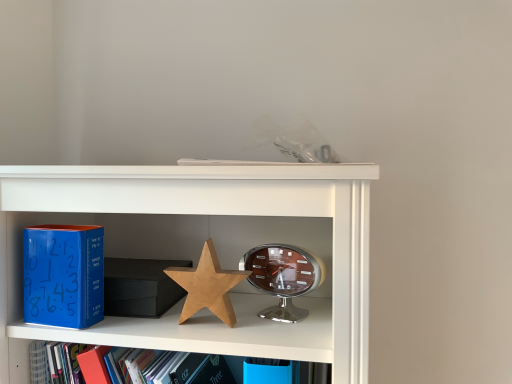
Question: In the image, is wooden star at center positioned in front of or behind blue matte clock at left?

Choices:
 (A) front
 (B) behind

Answer: (B)

Question: From a real-world perspective, is wooden star at center positioned above or below blue matte clock at left?

Choices:
 (A) below
 (B) above

Answer: (A)

Question: Which of these objects is positioned closest to the shiny silver alarm clock at center?

Choices:
 (A) wooden star at center
 (B) blue matte clock at left

Answer: (A)

Question: Which of these objects is positioned farthest from the blue matte clock at left?

Choices:
 (A) wooden star at center
 (B) shiny silver alarm clock at center

Answer: (B)